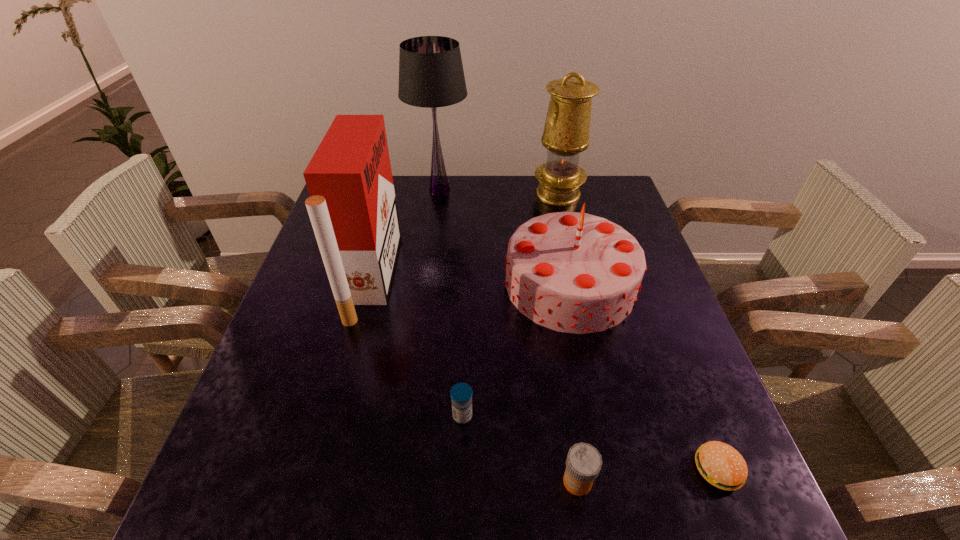
In order to click on vacant region at the right edge of the desktop in this screenshot , I will do `click(724, 435)`.

The height and width of the screenshot is (540, 960). In the image, there is a desktop. Find the location of `blank space at the near left corner`. blank space at the near left corner is located at coordinates (284, 523).

This screenshot has width=960, height=540. Find the location of `vacant space at the far right corner of the desktop`. vacant space at the far right corner of the desktop is located at coordinates (580, 198).

I want to click on vacant space that's between the cigarette case and the oil lamp, so click(465, 235).

Where is `free space between the cigarette case and the left medicine`? The image size is (960, 540). free space between the cigarette case and the left medicine is located at coordinates (418, 346).

Where is `vacant space in between the oil lamp and the farther medicine`? Image resolution: width=960 pixels, height=540 pixels. vacant space in between the oil lamp and the farther medicine is located at coordinates (511, 305).

The height and width of the screenshot is (540, 960). Find the location of `vacant space in between the oil lamp and the left medicine`. vacant space in between the oil lamp and the left medicine is located at coordinates (511, 305).

Identify the location of vacant point located between the birthday cake and the right medicine. (574, 383).

At what (x,y) coordinates should I click in order to perform the action: click on vacant point located between the cigarette case and the right medicine. Please return your answer as a coordinate pair (x, y). Looking at the image, I should click on (474, 379).

Identify the location of empty location between the oil lamp and the shortest object. (638, 332).